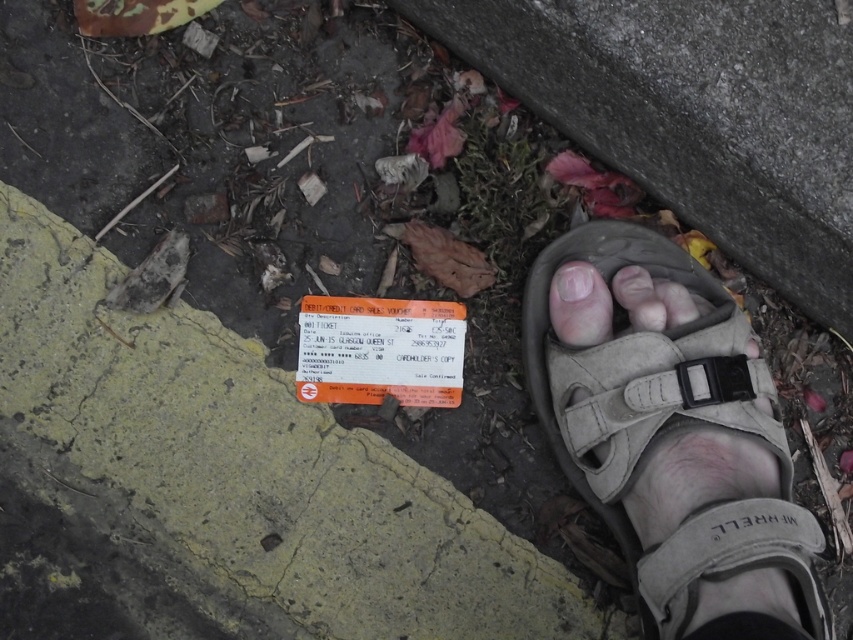
Consider the image. Does tan suede sandal at lower right lie behind pink flesh at center?

No, it is in front of pink flesh at center.

Does point (786, 483) lie in front of point (566, 276)?

Yes, point (786, 483) is closer to viewer.

Does point (786, 531) come behind point (581, 298)?

No, it is not.

Identify the location of tan suede sandal at lower right. The height and width of the screenshot is (640, 853). (676, 442).

Does pale skin toe at center have a lesser height compared to pink flesh at center?

No, pale skin toe at center is not shorter than pink flesh at center.

Is pale skin toe at center above pink flesh at center?

No.

Is point (567, 307) positioned before point (561, 273)?

Yes, point (567, 307) is in front of point (561, 273).

The image size is (853, 640). Find the location of `pale skin toe at center`. pale skin toe at center is located at coordinates (579, 305).

Between tan suede sandal at lower right and pale skin toe at center, which one appears on the left side from the viewer's perspective?

From the viewer's perspective, pale skin toe at center appears more on the left side.

Can you confirm if tan suede sandal at lower right is taller than pale skin toe at center?

Indeed, tan suede sandal at lower right has a greater height compared to pale skin toe at center.

Who is more distant from viewer, (605, 518) or (552, 305)?

The point (552, 305) is behind.

Where is `tan suede sandal at lower right`? tan suede sandal at lower right is located at coordinates (676, 442).